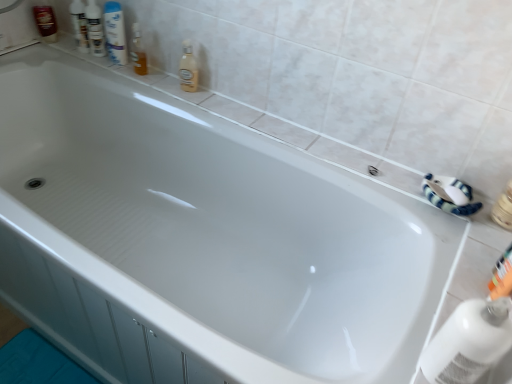
I want to click on unoccupied space behind orange plastic toothbrush at lower right, the fifth toiletry from the left, so click(x=467, y=236).